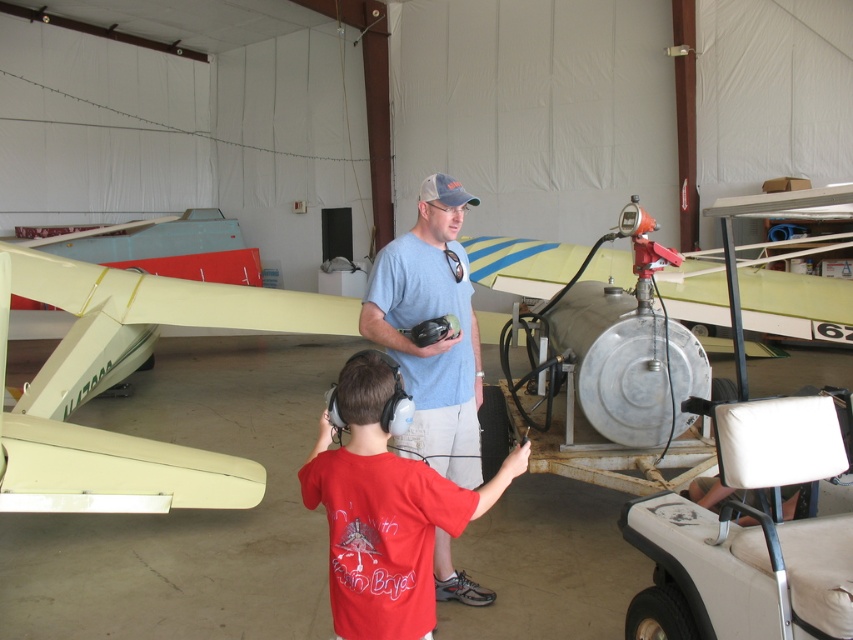
Question: Considering the relative positions of red cotton shirt at center and blue cotton t-shirt at center in the image provided, where is red cotton shirt at center located with respect to blue cotton t-shirt at center?

Choices:
 (A) left
 (B) right

Answer: (A)

Question: Which of the following is the closest to the observer?

Choices:
 (A) (461, 362)
 (B) (143, 349)

Answer: (A)

Question: Which of these objects is positioned farthest from the red cotton shirt at center?

Choices:
 (A) beige fabric golf cart at lower right
 (B) light yellow plastic airplane at center

Answer: (B)

Question: Is red cotton shirt at center to the left of blue cotton t-shirt at center from the viewer's perspective?

Choices:
 (A) yes
 (B) no

Answer: (A)

Question: Is red cotton shirt at center behind blue cotton t-shirt at center?

Choices:
 (A) yes
 (B) no

Answer: (B)

Question: Which point is closer to the camera taking this photo?

Choices:
 (A) (428, 490)
 (B) (50, 433)
 (C) (782, 561)

Answer: (A)